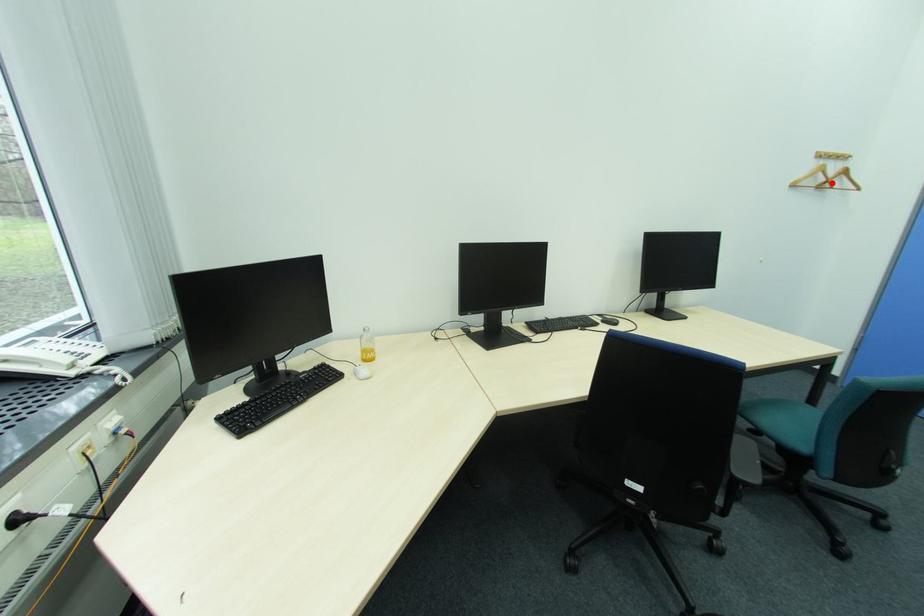
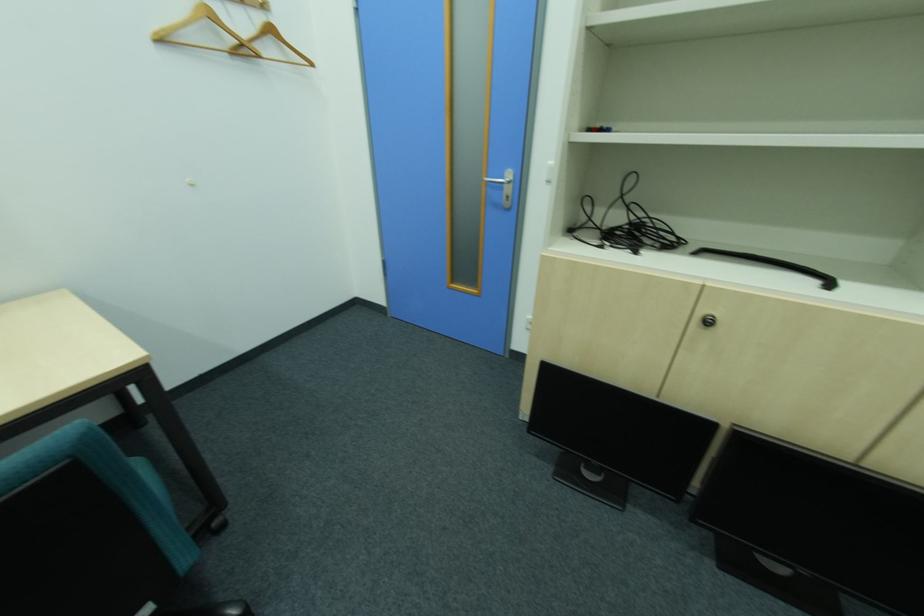
Question: A red point is marked in image1. In image2, is the corresponding 3D point closer to the camera or farther? Reply with the corresponding letter.

Choices:
 (A) The corresponding 3D point is closer.
 (B) The corresponding 3D point is farther.

Answer: (A)